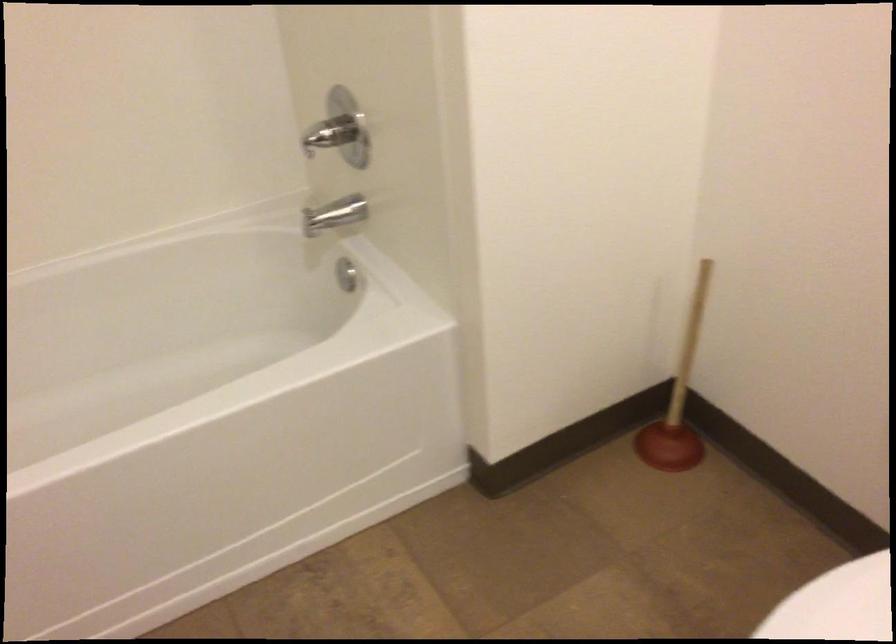
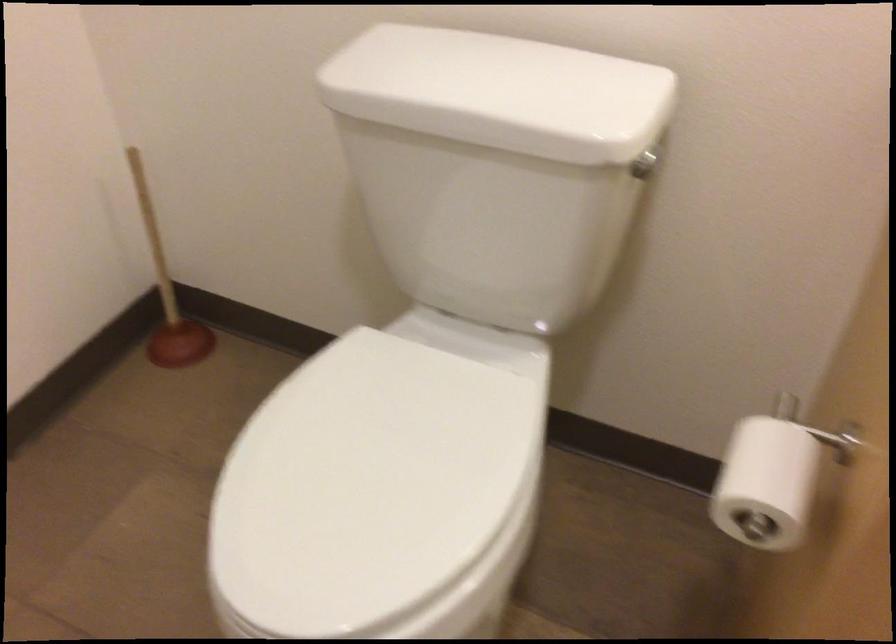
Find the pixel in the second image that matches (675,386) in the first image.

(167, 292)